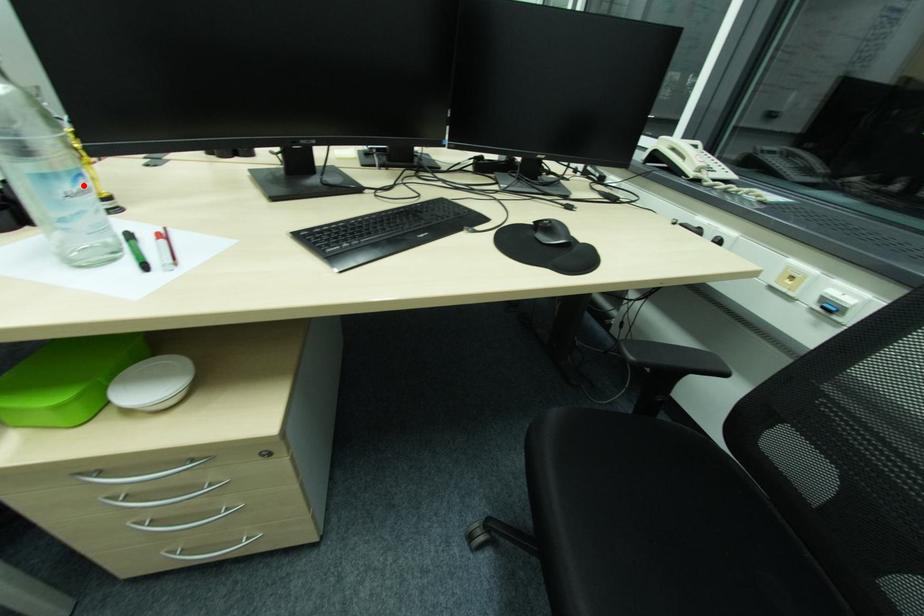
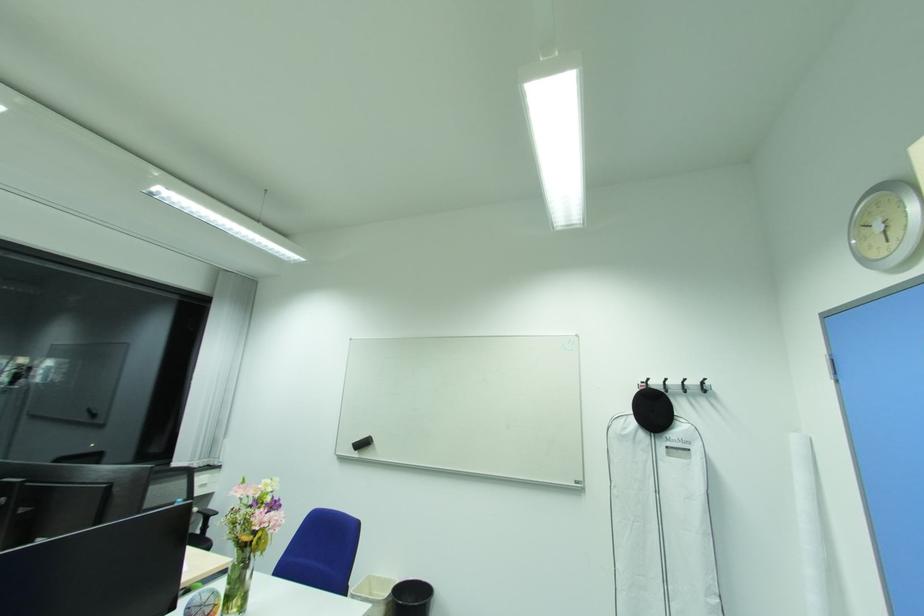
Question: I am providing you with two images of the same scene from different viewpoints. A red point is marked on the first image. Is the red point's position out of view in image 2?

Choices:
 (A) Yes
 (B) No

Answer: (A)